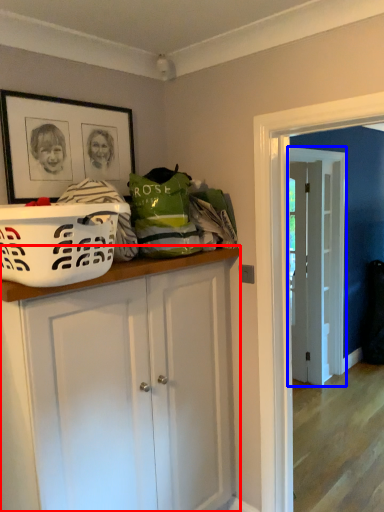
Question: Which point is further to the camera, cabinetry (highlighted by a red box) or door (highlighted by a blue box)?

Choices:
 (A) cabinetry
 (B) door

Answer: (B)